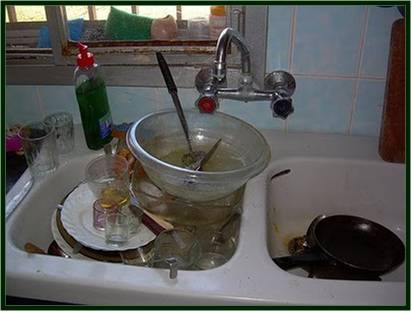
The image size is (412, 312). Identify the location of cold water knob. (284, 109).